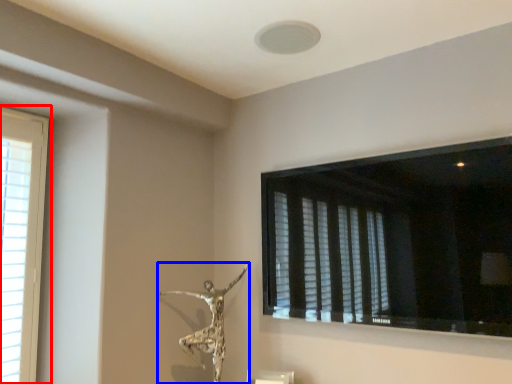
Question: Which point is closer to the camera, window (highlighted by a red box) or sculpture (highlighted by a blue box)?

Choices:
 (A) window
 (B) sculpture

Answer: (A)